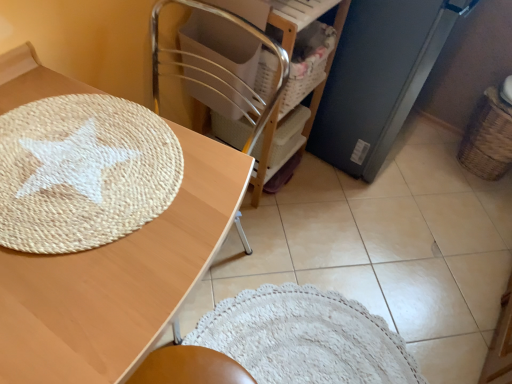
Question: Is woven brown basket at right further to the viewer compared to natural wood table at upper left?

Choices:
 (A) no
 (B) yes

Answer: (B)

Question: Is woven brown basket at right touching natural wood table at upper left?

Choices:
 (A) yes
 (B) no

Answer: (B)

Question: Is woven brown basket at right closer to camera compared to natural wood table at upper left?

Choices:
 (A) yes
 (B) no

Answer: (B)

Question: Considering the relative sizes of woven brown basket at right and natural wood table at upper left in the image provided, is woven brown basket at right bigger than natural wood table at upper left?

Choices:
 (A) yes
 (B) no

Answer: (B)

Question: Would you say woven brown basket at right is a long distance from natural wood table at upper left?

Choices:
 (A) yes
 (B) no

Answer: (A)

Question: Is matte black refrigerator at right spatially inside wooden chair at center, or outside of it?

Choices:
 (A) outside
 (B) inside

Answer: (A)

Question: Considering the positions of point (369, 29) and point (244, 147), is point (369, 29) closer or farther from the camera than point (244, 147)?

Choices:
 (A) farther
 (B) closer

Answer: (B)

Question: Considering the relative positions of matte black refrigerator at right and wooden chair at center in the image provided, is matte black refrigerator at right to the left or to the right of wooden chair at center?

Choices:
 (A) right
 (B) left

Answer: (A)

Question: Is matte black refrigerator at right taller or shorter than wooden chair at center?

Choices:
 (A) short
 (B) tall

Answer: (B)

Question: In the image, is wooden chair at center on the left side or the right side of natural wood table at upper left?

Choices:
 (A) right
 (B) left

Answer: (A)

Question: From the image's perspective, is wooden chair at center positioned above or below natural wood table at upper left?

Choices:
 (A) above
 (B) below

Answer: (A)

Question: Looking at their shapes, would you say wooden chair at center is wider or thinner than natural wood table at upper left?

Choices:
 (A) thin
 (B) wide

Answer: (A)

Question: Is wooden chair at center taller or shorter than natural wood table at upper left?

Choices:
 (A) tall
 (B) short

Answer: (A)

Question: Is woven brown basket at right inside or outside of matte black refrigerator at right?

Choices:
 (A) inside
 (B) outside

Answer: (B)

Question: From a real-world perspective, is woven brown basket at right physically located above or below matte black refrigerator at right?

Choices:
 (A) above
 (B) below

Answer: (B)